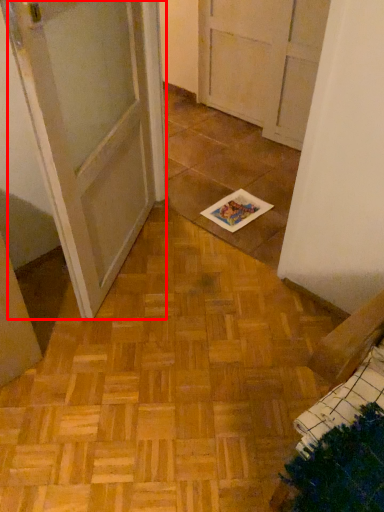
Question: From the image's perspective, what is the correct spatial positioning of door (annotated by the red box) in reference to book?

Choices:
 (A) above
 (B) below

Answer: (A)